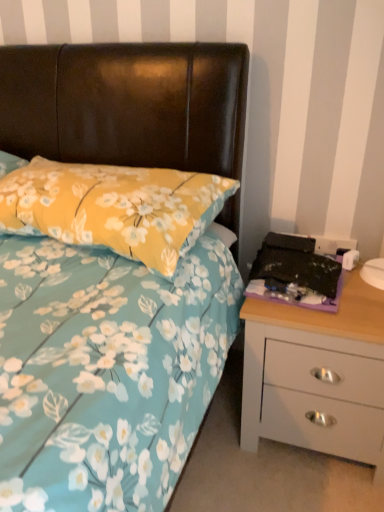
Question: From the image's perspective, is white matte chest of drawers at right located above yellow floral pillow at upper left?

Choices:
 (A) no
 (B) yes

Answer: (A)

Question: Is white matte chest of drawers at right not close to yellow floral pillow at upper left?

Choices:
 (A) yes
 (B) no

Answer: (B)

Question: Is white matte chest of drawers at right not within yellow floral pillow at upper left?

Choices:
 (A) no
 (B) yes

Answer: (B)

Question: Does white matte chest of drawers at right have a smaller size compared to yellow floral pillow at upper left?

Choices:
 (A) no
 (B) yes

Answer: (A)

Question: From a real-world perspective, is white matte chest of drawers at right on yellow floral pillow at upper left?

Choices:
 (A) yes
 (B) no

Answer: (B)

Question: Is yellow floral pillow at upper left surrounded by white matte chest of drawers at right?

Choices:
 (A) yes
 (B) no

Answer: (B)

Question: Can you confirm if yellow floral pillow at upper left is wider than white matte chest of drawers at right?

Choices:
 (A) no
 (B) yes

Answer: (B)

Question: Considering the relative positions of yellow floral pillow at upper left and white matte chest of drawers at right in the image provided, is yellow floral pillow at upper left in front of white matte chest of drawers at right?

Choices:
 (A) yes
 (B) no

Answer: (A)

Question: Is yellow floral pillow at upper left oriented away from white matte chest of drawers at right?

Choices:
 (A) yes
 (B) no

Answer: (B)

Question: Is white matte chest of drawers at right surrounded by yellow floral pillow at upper left?

Choices:
 (A) yes
 (B) no

Answer: (B)

Question: From the image's perspective, would you say yellow floral pillow at upper left is positioned over white matte chest of drawers at right?

Choices:
 (A) no
 (B) yes

Answer: (B)

Question: Considering the relative positions of yellow floral pillow at upper left and white matte chest of drawers at right in the image provided, is yellow floral pillow at upper left to the right of white matte chest of drawers at right from the viewer's perspective?

Choices:
 (A) yes
 (B) no

Answer: (B)

Question: Looking at their shapes, would you say white matte chest of drawers at right is wider or thinner than yellow floral pillow at upper left?

Choices:
 (A) thin
 (B) wide

Answer: (A)